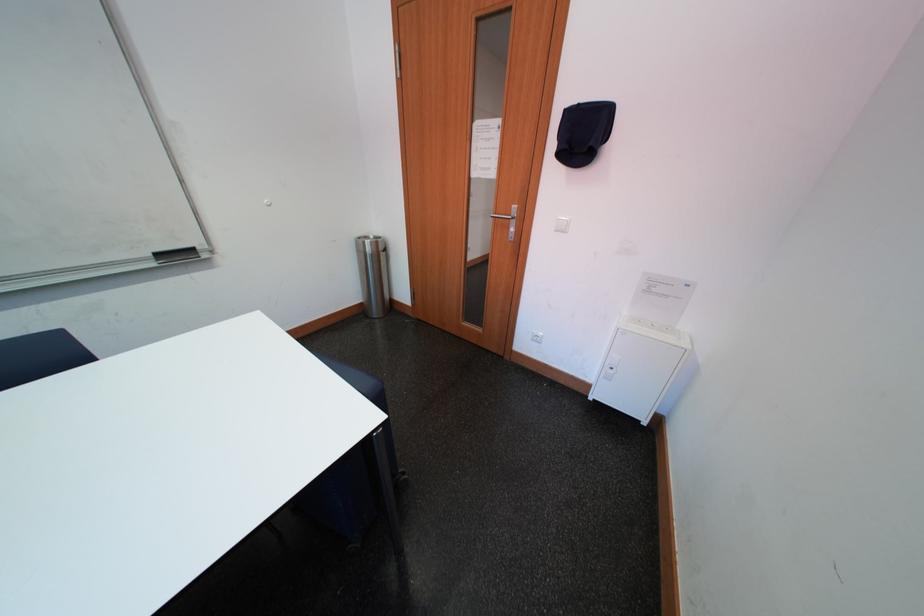
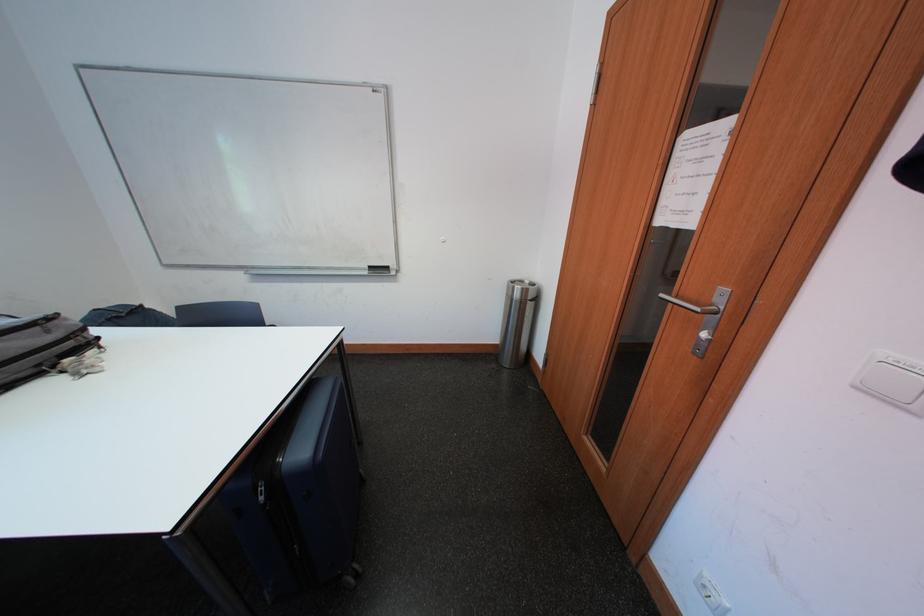
Question: How did the camera likely rotate?

Choices:
 (A) Left
 (B) Right
 (C) Up
 (D) Down

Answer: (A)